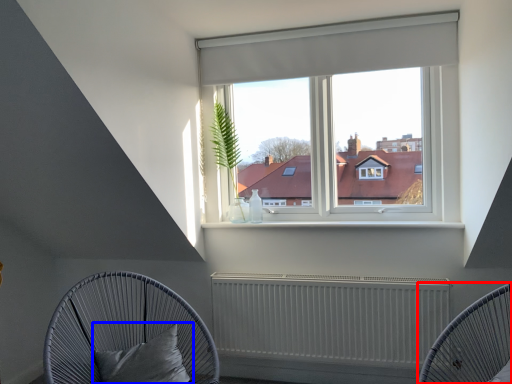
Question: Which point is closer to the camera, furniture (highlighted by a red box) or pillow (highlighted by a blue box)?

Choices:
 (A) furniture
 (B) pillow

Answer: (A)